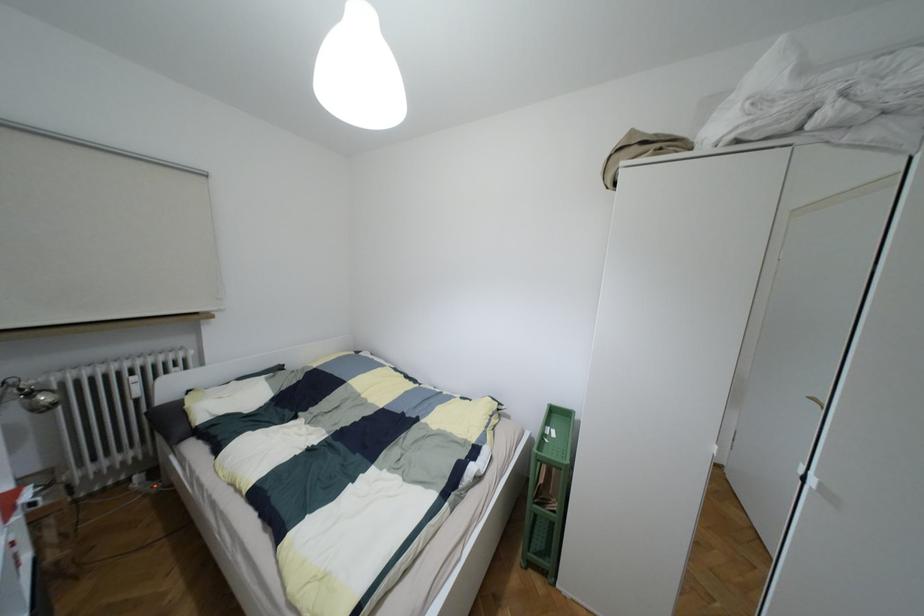
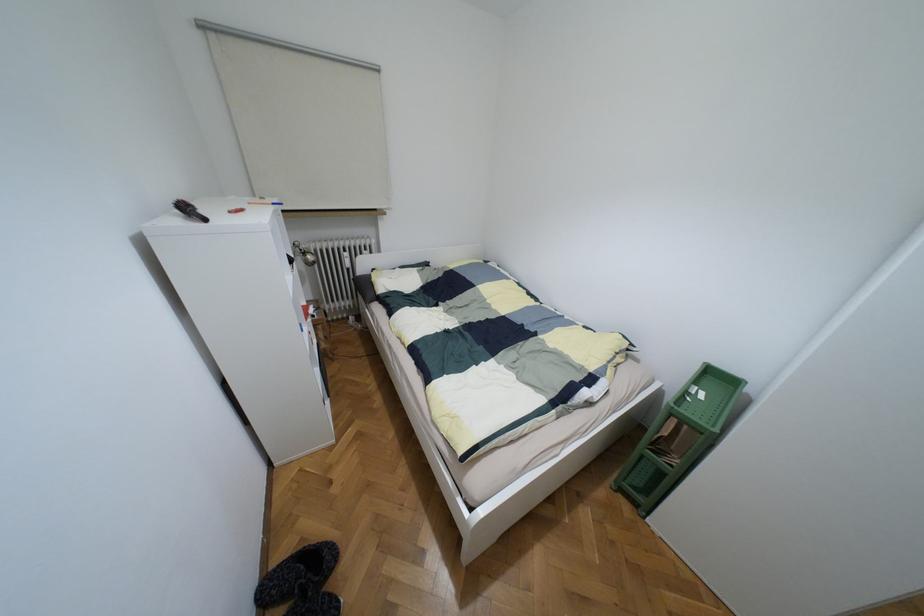
The images are taken continuously from a first-person perspective. In which direction is your viewpoint rotating?

The rotation direction of the camera is left-down.